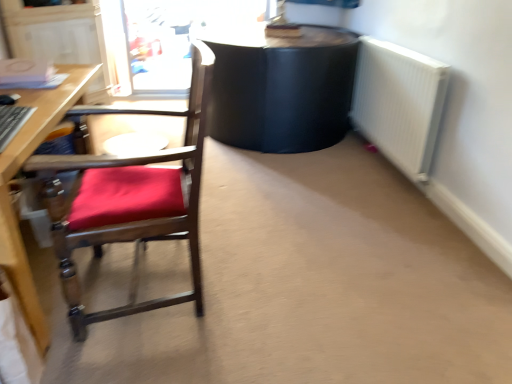
Question: Is white metallic radiator at right taller than wooden chair with red cushion at left?

Choices:
 (A) yes
 (B) no

Answer: (B)

Question: Can you see white metallic radiator at right touching wooden chair with red cushion at left?

Choices:
 (A) no
 (B) yes

Answer: (A)

Question: Can you confirm if white metallic radiator at right is shorter than wooden chair with red cushion at left?

Choices:
 (A) no
 (B) yes

Answer: (B)

Question: Is the position of white metallic radiator at right less distant than that of wooden chair with red cushion at left?

Choices:
 (A) no
 (B) yes

Answer: (A)

Question: Are white metallic radiator at right and wooden chair with red cushion at left far apart?

Choices:
 (A) yes
 (B) no

Answer: (A)

Question: Is wooden chair with red cushion at left located within white metallic radiator at right?

Choices:
 (A) no
 (B) yes

Answer: (A)

Question: Considering the relative sizes of transparent plastic screen door at upper left and white metallic radiator at right in the image provided, is transparent plastic screen door at upper left thinner than white metallic radiator at right?

Choices:
 (A) no
 (B) yes

Answer: (A)

Question: Is there a large distance between transparent plastic screen door at upper left and white metallic radiator at right?

Choices:
 (A) no
 (B) yes

Answer: (B)

Question: Is transparent plastic screen door at upper left oriented towards white metallic radiator at right?

Choices:
 (A) no
 (B) yes

Answer: (A)

Question: Can you confirm if transparent plastic screen door at upper left is wider than white metallic radiator at right?

Choices:
 (A) no
 (B) yes

Answer: (B)

Question: Can you confirm if transparent plastic screen door at upper left is positioned to the left of white metallic radiator at right?

Choices:
 (A) yes
 (B) no

Answer: (A)

Question: Is white metallic radiator at right at the back of transparent plastic screen door at upper left?

Choices:
 (A) no
 (B) yes

Answer: (A)

Question: Is transparent plastic screen door at upper left wider than wooden chair with red cushion at left?

Choices:
 (A) yes
 (B) no

Answer: (B)